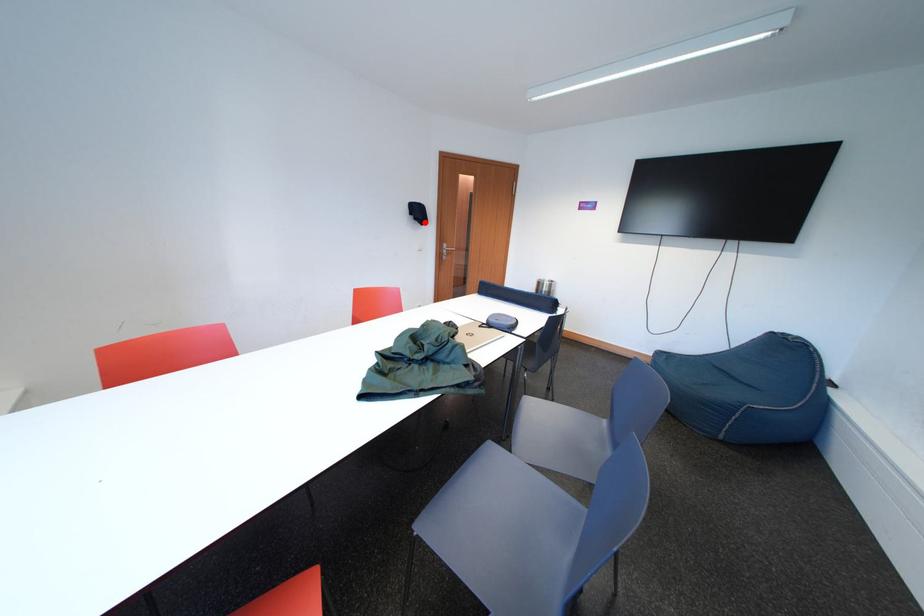
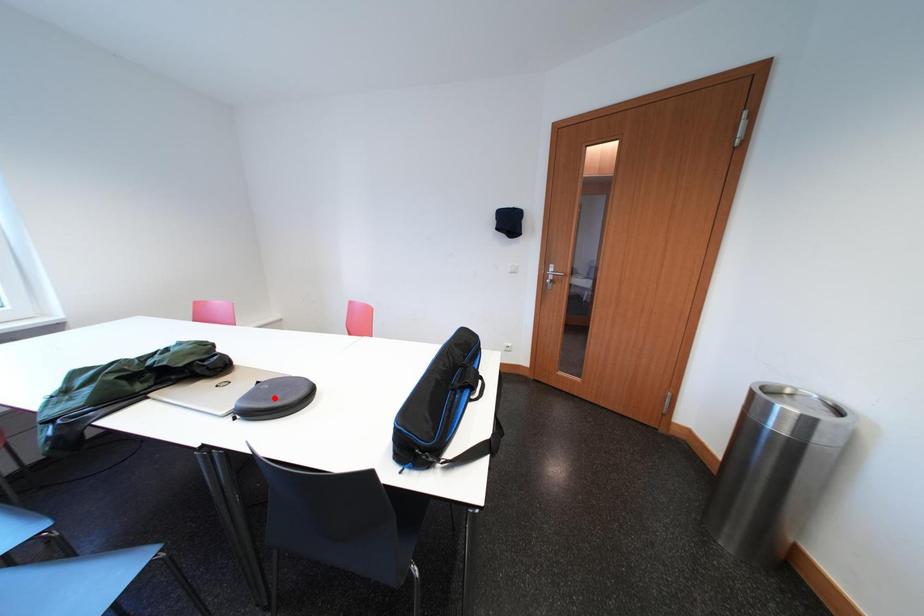
I am providing you with two images of the same scene from different viewpoints. A red point is marked on the first image and another point is marked on the second image. Does the point marked in image1 correspond to the same location as the one in image2?

No